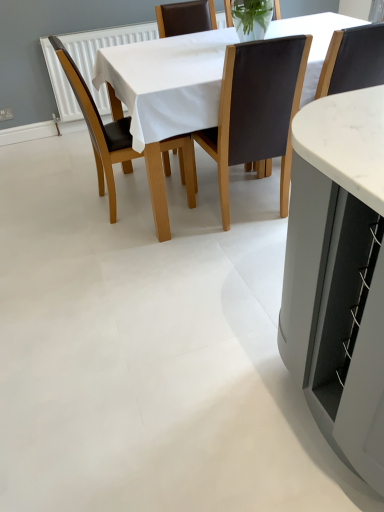
Identify the location of vacant area located to the right-hand side of brown leather chair at center, arranged as the 3th chair when viewed from the right. (200, 202).